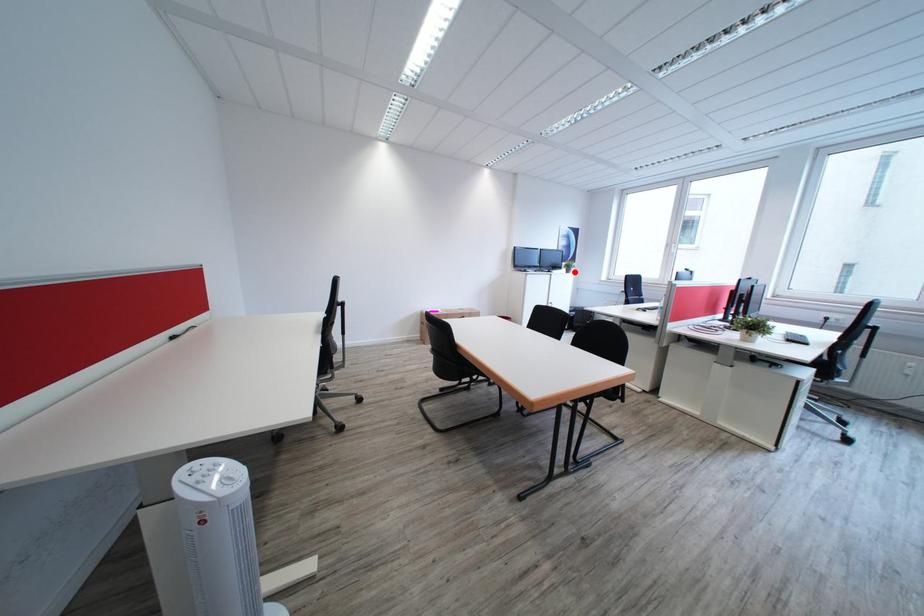
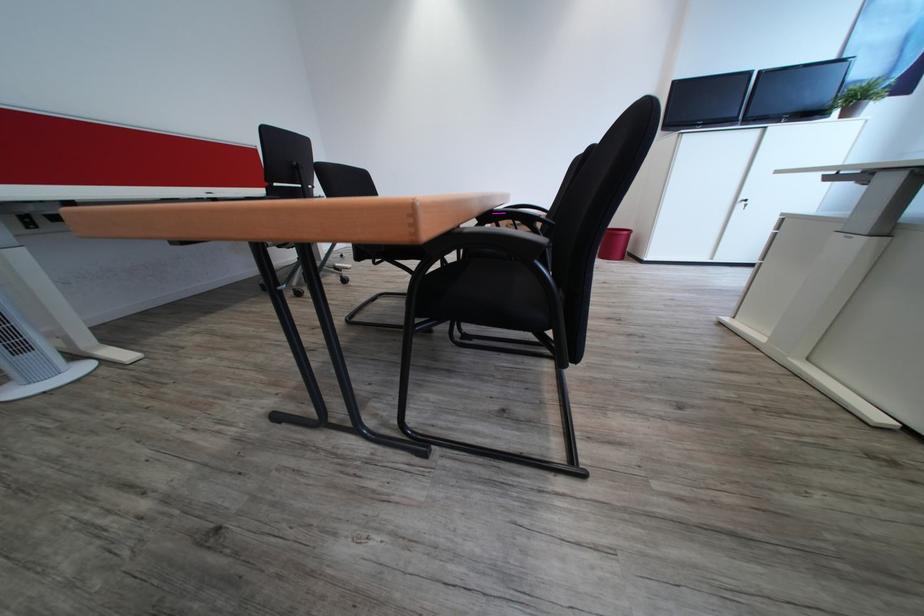
Question: I am providing you with two images of the same scene from different viewpoints. Image1 has a red point marked. In image2, the corresponding 3D location appears at what relative position? Reply with the corresponding letter.

Choices:
 (A) Closer
 (B) Farther

Answer: (B)